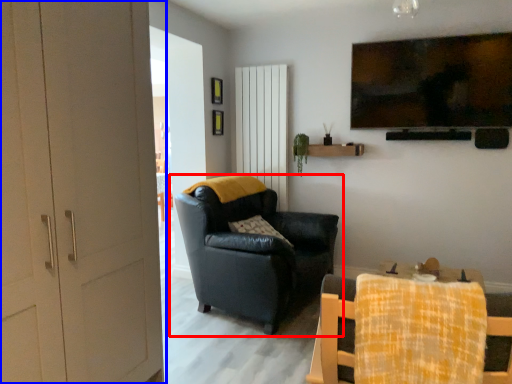
Question: Which object appears farthest to the camera in this image, chair (highlighted by a red box) or door (highlighted by a blue box)?

Choices:
 (A) chair
 (B) door

Answer: (A)